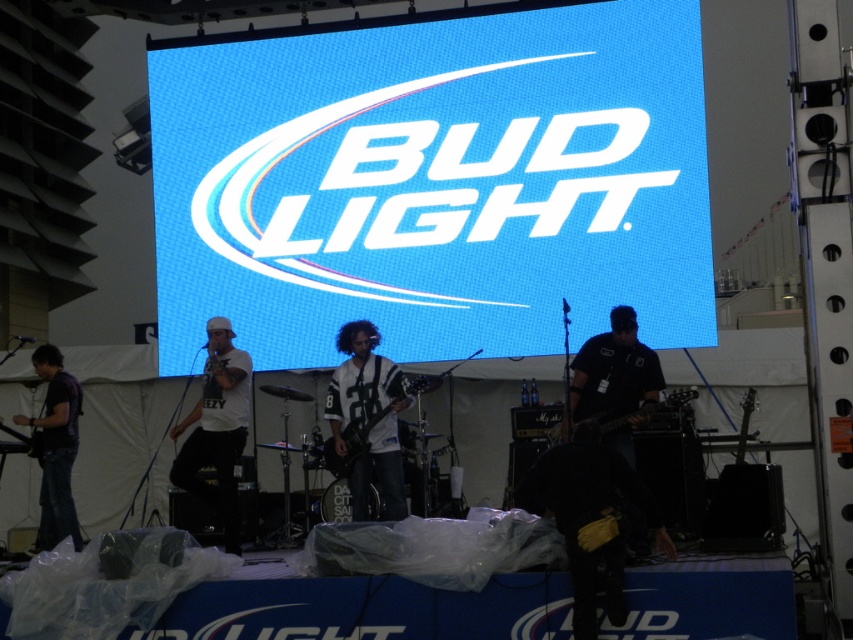
You are a photographer at the Bud Light sponsored event. You need to capture a closeup shot of the white jersey at center. Where exactly should you aim your camera?

The white jersey at center is located at point [368,417], so aim your camera there.

You are a photographer at the Bud Light event and want to capture a photo of both the white matte shirt at center and the dark purple shirt at left in the same frame. The camera you are using has a maximum focus range of 9 feet. Will you be able to fit both subjects into the frame without moving closer?

The white matte shirt at center and dark purple shirt at left are 9.39 feet apart from each other. Since the camera can only focus up to 9 feet, the distance between them exceeds the maximum focus range. Therefore, you cannot fit both subjects into the frame without moving closer.

You are a photographer at the Bud Light event and want to capture the drummer wearing the white matte shirt at center. According to the coordinates provided, where should you aim your camera to ensure the drummer is in the frame?

The drummer wearing the white matte shirt at center is located at coordinates point [218,429], so aim your camera there to capture them.